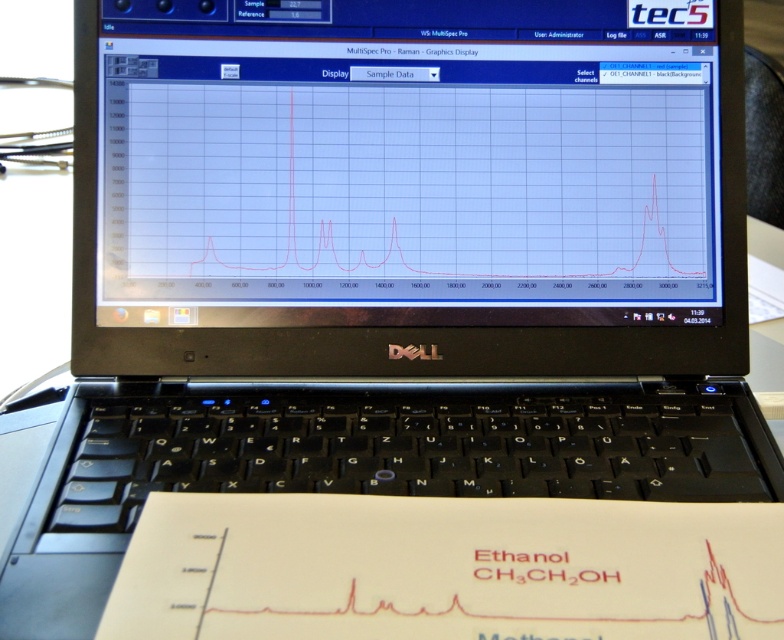
Question: Is matte black screen at center bigger than white paper at lower center?

Choices:
 (A) no
 (B) yes

Answer: (B)

Question: Which point is farther to the camera?

Choices:
 (A) (331, 538)
 (B) (172, 204)

Answer: (B)

Question: Among these points, which one is farthest from the camera?

Choices:
 (A) (329, 515)
 (B) (263, 48)

Answer: (B)

Question: In this image, where is matte black screen at center located relative to white paper at lower center?

Choices:
 (A) above
 (B) below

Answer: (A)

Question: Is matte black screen at center wider than white paper at lower center?

Choices:
 (A) no
 (B) yes

Answer: (B)